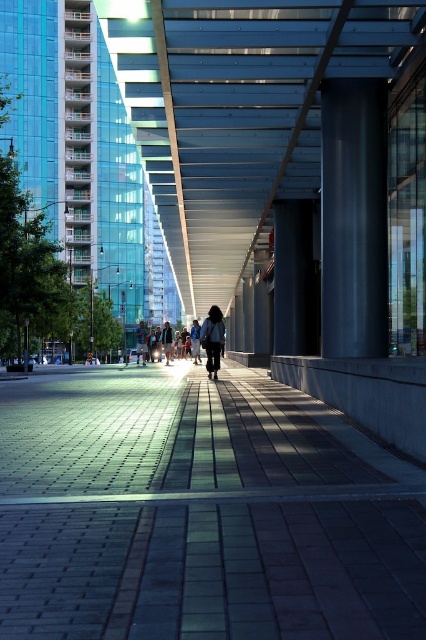
Based on the photo, you are standing at the entrance of the urban area and want to reach the brick paved sidewalk at center. According to the coordinates provided, which direction should you move towards?

The brick paved sidewalk at center is located at coordinates point (x=199, y=512), so you should move towards the center and slightly to the right to reach it.

You are a delivery person trying to walk along the brick paved sidewalk at center while avoiding stepping on the dark blue jeans at center. Can you fit through the space between them?

The brick paved sidewalk at center is wider than the dark blue jeans at center, so there is enough space to walk between them without stepping on the jeans.